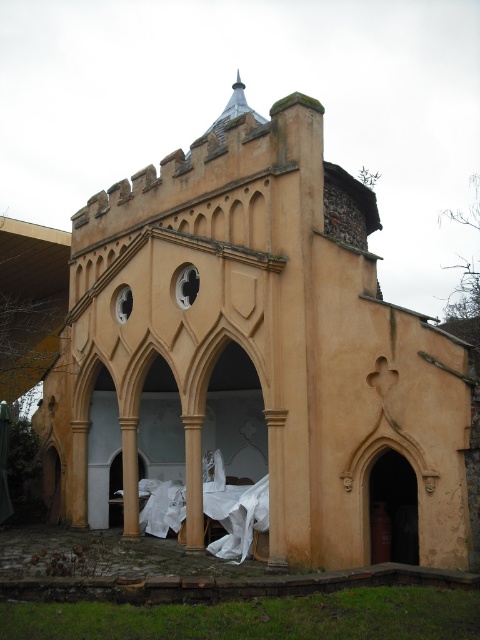
I want to click on smooth stone column at center, so click(276, 490).

Does smooth stone column at center lie behind beige stone column at center?

No, smooth stone column at center is in front of beige stone column at center.

Locate an element on the screen. smooth stone column at center is located at coordinates (276, 490).